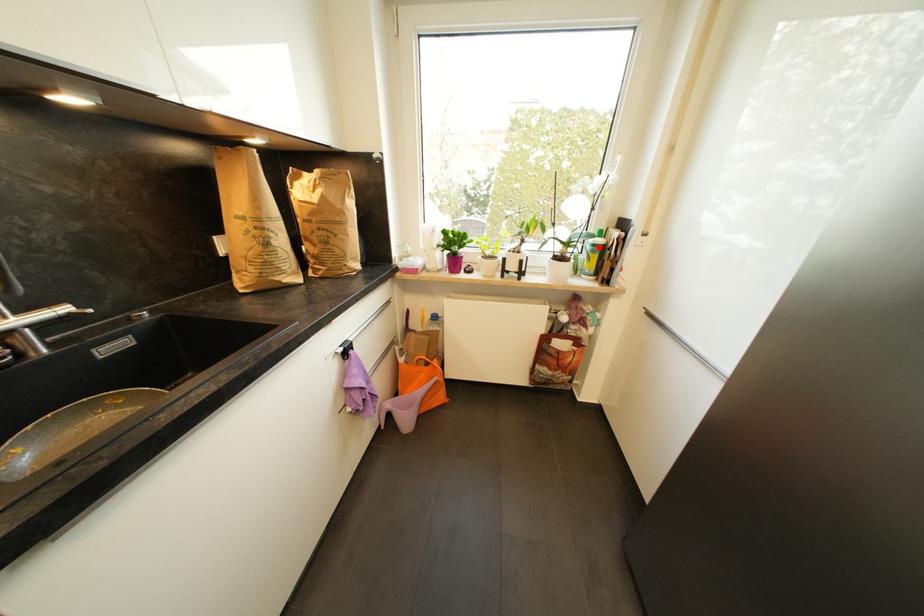
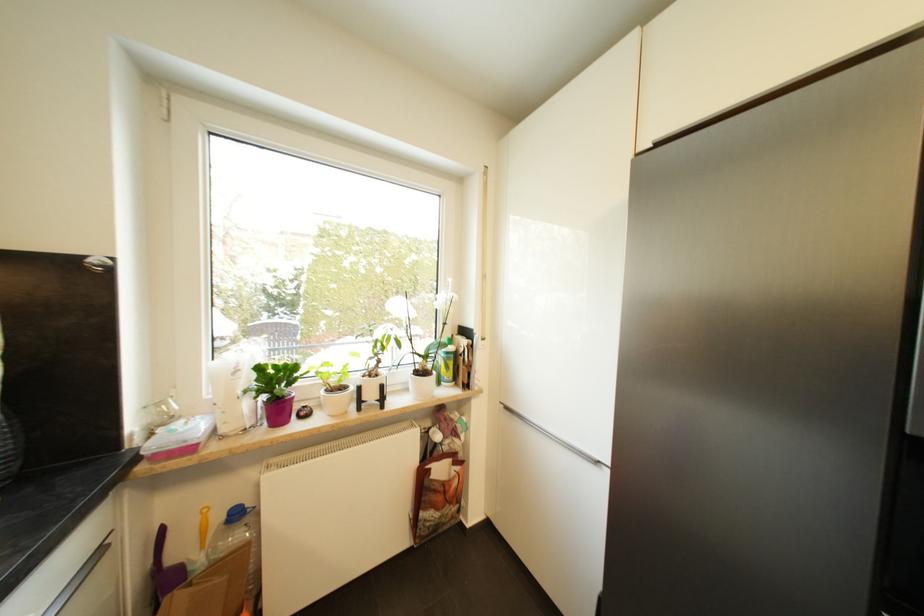
Question: I am providing you with two images of the same scene from different viewpoints. Image1 has a red point marked. In image2, the corresponding 3D location appears at what relative position? Reply with the corresponding letter.

Choices:
 (A) Closer
 (B) Farther

Answer: (B)